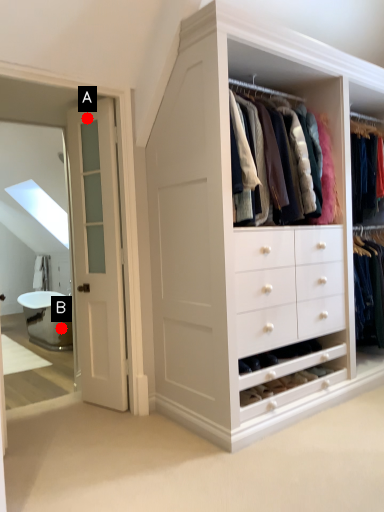
Question: Two points are circled on the image, labeled by A and B beside each circle. Which of the following is the farthest from the observer?

Choices:
 (A) A is further
 (B) B is further

Answer: (B)